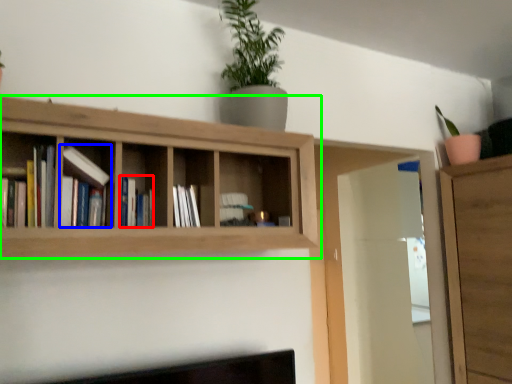
Question: Which object is the farthest from book (highlighted by a red box)? Choose among these: book (highlighted by a blue box) or shelf (highlighted by a green box).

Choices:
 (A) book
 (B) shelf

Answer: (B)